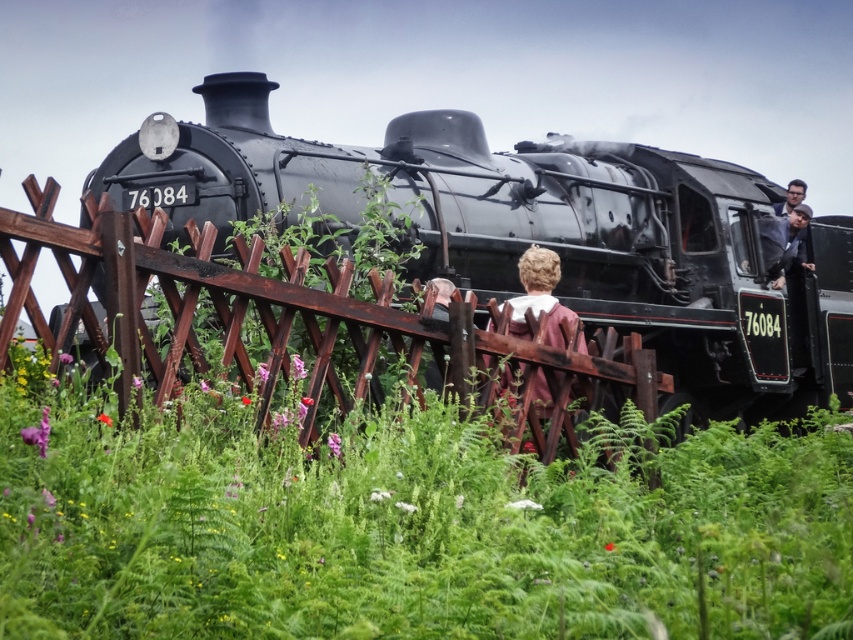
Is green leafy grass at center bigger than smooth brown hair at upper right?

Actually, green leafy grass at center might be smaller than smooth brown hair at upper right.

Who is more distant from viewer, (827, 468) or (786, 196)?

The point (786, 196) is more distant.

This screenshot has width=853, height=640. Describe the element at coordinates (410, 524) in the screenshot. I see `green leafy grass at center` at that location.

The height and width of the screenshot is (640, 853). What are the coordinates of `green leafy grass at center` in the screenshot? It's located at (410, 524).

Is point (569, 321) farther from viewer compared to point (802, 189)?

No.

In the scene shown: Who is taller, brown leather jacket at center or smooth brown hair at upper right?

Standing taller between the two is smooth brown hair at upper right.

Locate an element on the screen. The height and width of the screenshot is (640, 853). brown leather jacket at center is located at coordinates (538, 296).

Identify the location of brown leather jacket at center. The width and height of the screenshot is (853, 640). (538, 296).

Describe the element at coordinates (302, 321) in the screenshot. This screenshot has height=640, width=853. I see `brown wooden fence at center` at that location.

Can you confirm if brown wooden fence at center is positioned to the left of brown leather jacket at center?

Indeed, brown wooden fence at center is positioned on the left side of brown leather jacket at center.

You are a GUI agent. You are given a task and a screenshot of the screen. Output one action in this format:
    pyautogui.click(x=<x>, y=<y>)
    Task: Click on the brown wooden fence at center
    
    Given the screenshot: What is the action you would take?
    pyautogui.click(x=302, y=321)